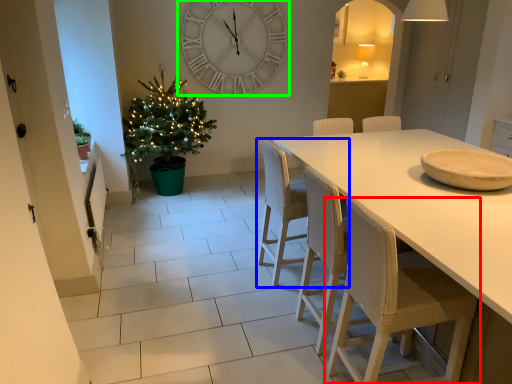
Question: Which object is the closest to the chair (highlighted by a red box)? Choose among these: chair (highlighted by a blue box) or wall clock (highlighted by a green box).

Choices:
 (A) chair
 (B) wall clock

Answer: (A)